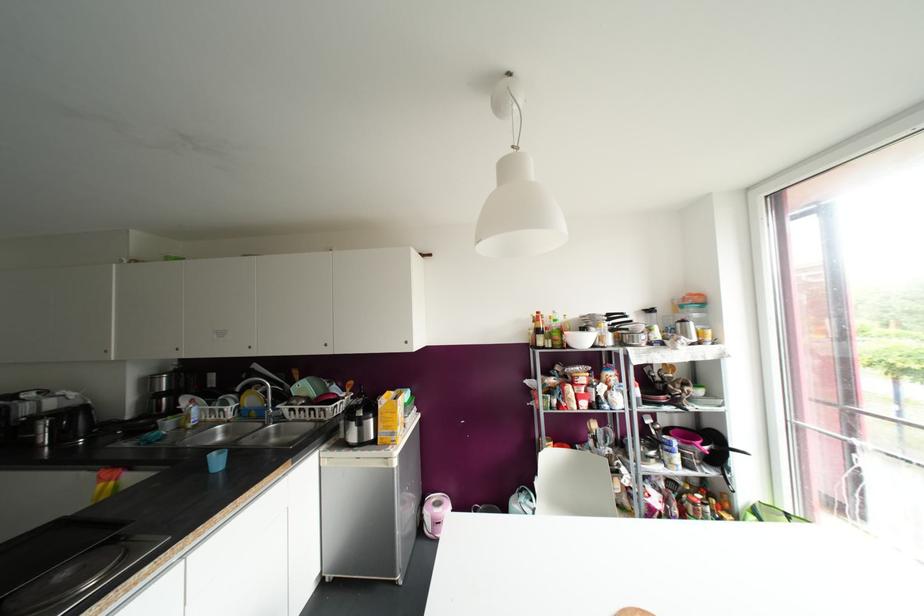
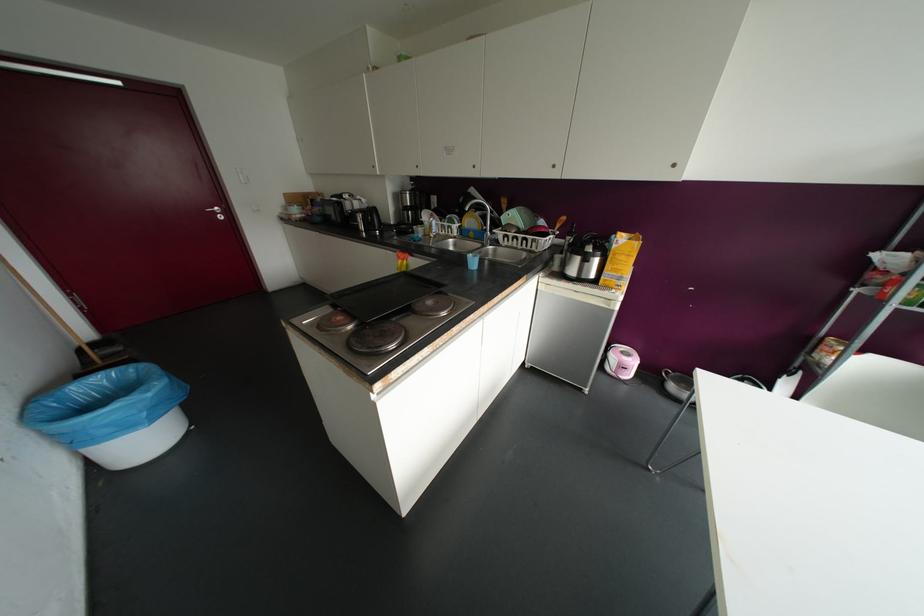
Where in the second image is the point corresponding to point 406,342 from the first image?

(673, 164)